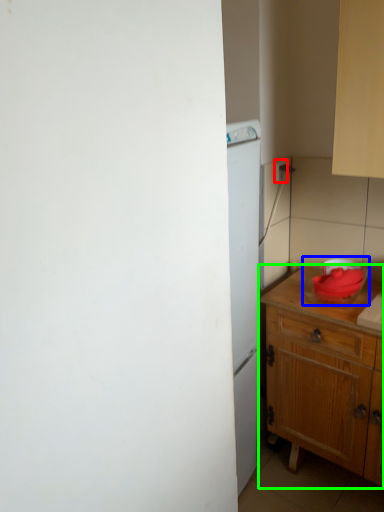
Question: Estimate the real-world distances between objects in this image. Which object is closer to electric outlet (highlighted by a red box), appliance (highlighted by a blue box) or table (highlighted by a green box)?

Choices:
 (A) appliance
 (B) table

Answer: (A)